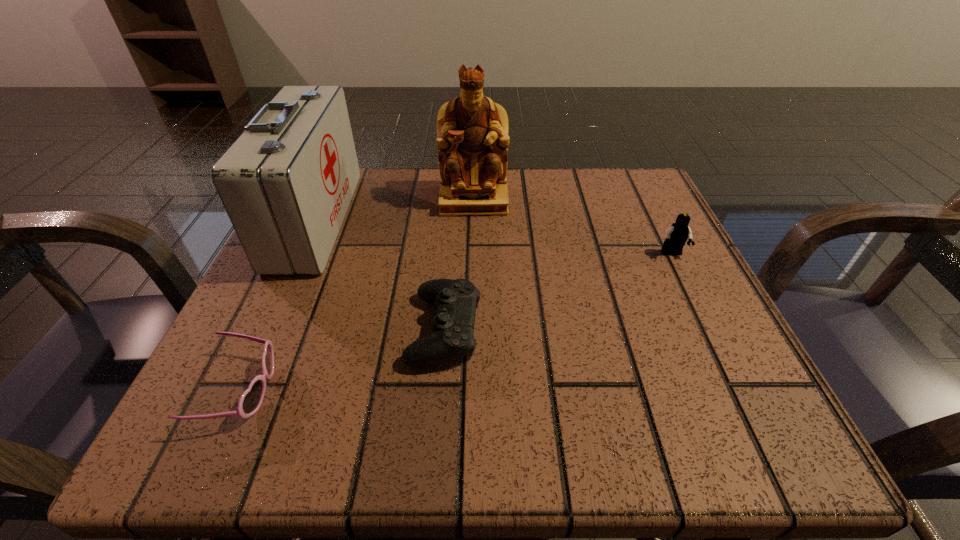
This screenshot has height=540, width=960. I want to click on blank area at the near edge, so [x=414, y=439].

Identify the location of vacant space at the left edge of the desktop. (303, 354).

In the image, there is a desktop. In order to click on vacant space at the right edge in this screenshot , I will do `click(655, 363)`.

The image size is (960, 540). What are the coordinates of `vacant area at the far left corner` in the screenshot? It's located at (365, 181).

Image resolution: width=960 pixels, height=540 pixels. Find the location of `free space at the far right corner of the desktop`. free space at the far right corner of the desktop is located at coordinates (657, 216).

Image resolution: width=960 pixels, height=540 pixels. What are the coordinates of `free area in between the second shortest object and the third shortest object` in the screenshot? It's located at (558, 292).

Where is `vacant area that lies between the fourth tallest object and the third tallest object`? vacant area that lies between the fourth tallest object and the third tallest object is located at coordinates (558, 292).

This screenshot has width=960, height=540. Identify the location of free space between the second tallest object and the fourth tallest object. (380, 274).

The width and height of the screenshot is (960, 540). I want to click on vacant area that lies between the control and the figurine, so click(459, 265).

You are a GUI agent. You are given a task and a screenshot of the screen. Output one action in this format:
    pyautogui.click(x=<x>, y=<y>)
    Task: Click on the free space between the control and the figurine
    This screenshot has height=540, width=960.
    Given the screenshot: What is the action you would take?
    pyautogui.click(x=459, y=265)